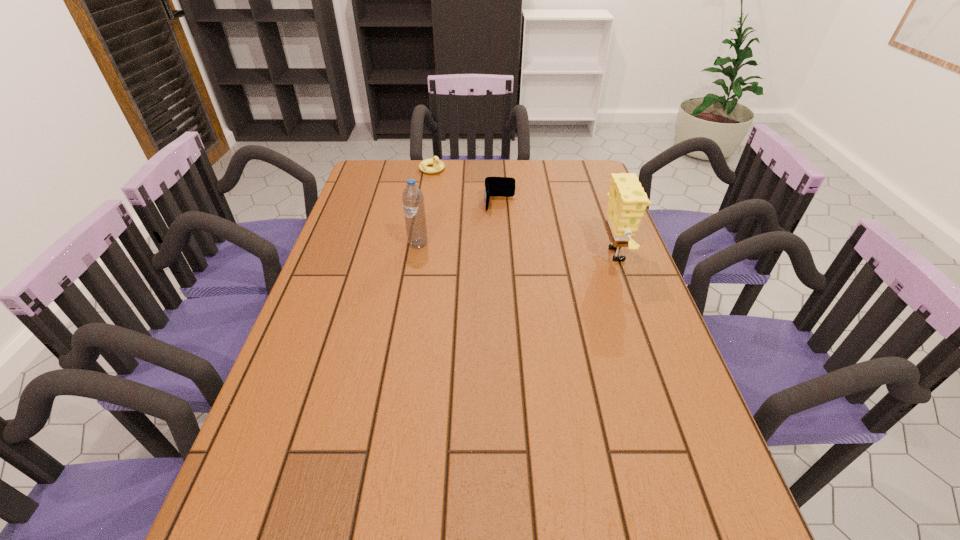
I want to click on vacant space at the near right corner, so click(710, 498).

Where is `vacant point located between the second object from right to left and the sponge`? vacant point located between the second object from right to left and the sponge is located at coordinates (560, 230).

The height and width of the screenshot is (540, 960). Identify the location of vacant space that's between the third object from left to right and the farthest object. (466, 186).

This screenshot has width=960, height=540. Identify the location of free area in between the duckling and the water bottle. (425, 206).

The height and width of the screenshot is (540, 960). I want to click on free spot between the duckling and the sponge, so click(x=525, y=212).

Identify the location of unoccupied area between the farthest object and the rightmost object. (525, 212).

At what (x,y) coordinates should I click in order to perform the action: click on free point between the farthest object and the water bottle. Please return your answer as a coordinate pair (x, y). Looking at the image, I should click on (425, 206).

The width and height of the screenshot is (960, 540). In order to click on unoccupied area between the water bottle and the farthest object in this screenshot , I will do point(425,206).

Where is `vacant space that's between the rightmost object and the water bottle`? vacant space that's between the rightmost object and the water bottle is located at coordinates (518, 249).

Locate an element on the screen. free space between the water bottle and the duckling is located at coordinates (425, 206).